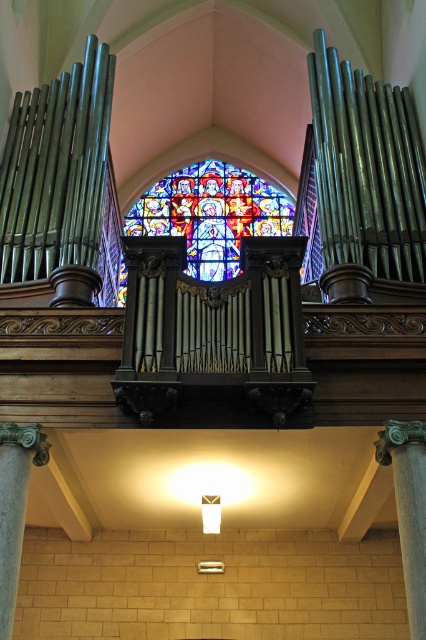
Question: Considering the real-world distances, which object is farthest from the green stone column at center?

Choices:
 (A) gray stone column at lower left
 (B) polished silver organ pipes at left
 (C) polished silver pipes at upper right
 (D) stained glass at center

Answer: (D)

Question: Which object appears closest to the camera in this image?

Choices:
 (A) green stone column at center
 (B) gray stone column at lower left
 (C) polished silver pipes at upper right
 (D) polished silver organ pipes at left

Answer: (B)

Question: Is polished silver organ pipes at left positioned before green stone column at center?

Choices:
 (A) no
 (B) yes

Answer: (A)

Question: Can you confirm if green stone column at center is smaller than gray stone column at lower left?

Choices:
 (A) yes
 (B) no

Answer: (B)

Question: Which point is closer to the camera?

Choices:
 (A) gray stone column at lower left
 (B) polished silver pipes at upper right

Answer: (A)

Question: Is stained glass at center closer to camera compared to gray stone column at lower left?

Choices:
 (A) yes
 (B) no

Answer: (B)